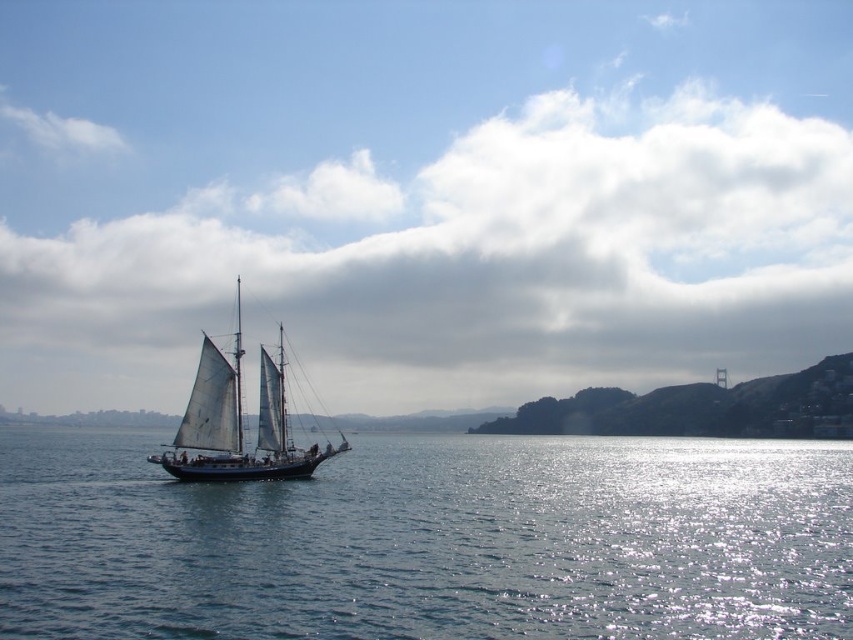
Which of these two, blue water at center or white sailboat at center, stands shorter?

white sailboat at center

Can you confirm if blue water at center is positioned to the right of white sailboat at center?

Incorrect, blue water at center is not on the right side of white sailboat at center.

This screenshot has height=640, width=853. What are the coordinates of `blue water at center` in the screenshot? It's located at (430, 540).

Is white fluffy cloud at upper center taller than blue water at center?

Yes, white fluffy cloud at upper center is taller than blue water at center.

Between white fluffy cloud at upper center and blue water at center, which one has less height?

With less height is blue water at center.

The image size is (853, 640). What do you see at coordinates (467, 266) in the screenshot?
I see `white fluffy cloud at upper center` at bounding box center [467, 266].

You are a GUI agent. You are given a task and a screenshot of the screen. Output one action in this format:
    pyautogui.click(x=<x>, y=<y>)
    Task: Click on the white fluffy cloud at upper center
    The image size is (853, 640).
    Given the screenshot: What is the action you would take?
    pyautogui.click(x=467, y=266)

Between white fluffy cloud at upper center and white sailboat at center, which one appears on the right side from the viewer's perspective?

white fluffy cloud at upper center is more to the right.

Who is more distant from viewer, (634, 339) or (238, 355)?

The point (634, 339) is more distant.

Is point (746, 253) farther from camera compared to point (212, 410)?

Yes, it is behind point (212, 410).

At what (x,y) coordinates should I click in order to perform the action: click on white fluffy cloud at upper center. Please return your answer as a coordinate pair (x, y). The width and height of the screenshot is (853, 640). Looking at the image, I should click on (467, 266).